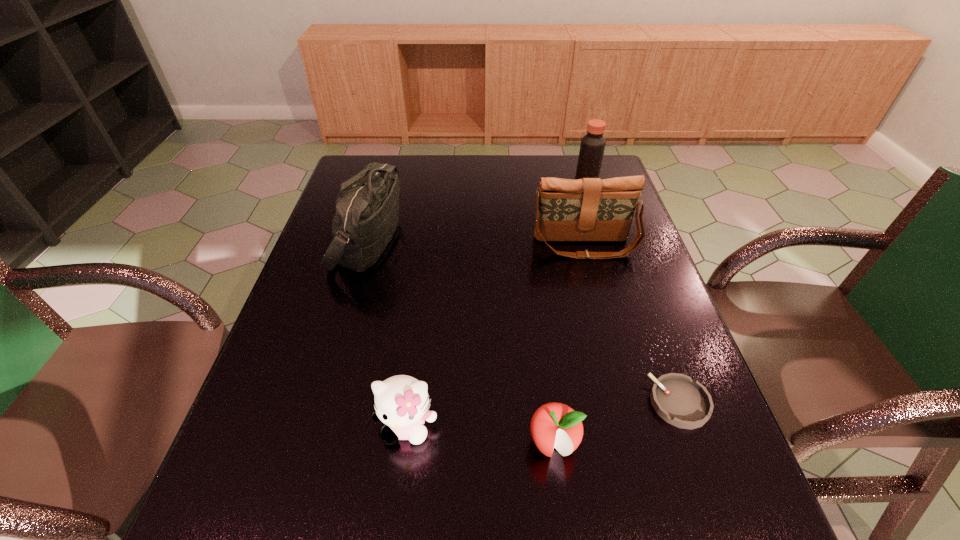
The width and height of the screenshot is (960, 540). Find the location of `vacant space at the far edge of the desktop`. vacant space at the far edge of the desktop is located at coordinates pos(438,165).

This screenshot has height=540, width=960. I want to click on free spot at the near edge of the desktop, so (652, 518).

At what (x,y) coordinates should I click in order to perform the action: click on free region at the left edge of the desktop. Please return your answer as a coordinate pair (x, y). Looking at the image, I should click on (285, 385).

Find the location of `vacant space at the right edge`. vacant space at the right edge is located at coordinates (638, 319).

This screenshot has width=960, height=540. Find the location of `free space between the second object from left to right and the vinegar`. free space between the second object from left to right and the vinegar is located at coordinates (496, 306).

The height and width of the screenshot is (540, 960). I want to click on free point between the right shoulder bag and the taller shoulder bag, so click(476, 244).

You are a GUI agent. You are given a task and a screenshot of the screen. Output one action in this format:
    pyautogui.click(x=<x>, y=<y>)
    Task: Click on the vacant region between the third shortest object and the farthest object
    The height and width of the screenshot is (540, 960).
    Given the screenshot: What is the action you would take?
    pyautogui.click(x=496, y=306)

At what (x,y) coordinates should I click in order to perform the action: click on free space between the fifth tallest object and the farthest object. Please return your answer as a coordinate pair (x, y). Looking at the image, I should click on (569, 315).

The width and height of the screenshot is (960, 540). I want to click on unoccupied position between the taller shoulder bag and the shortest object, so click(524, 322).

Locate an element on the screen. The width and height of the screenshot is (960, 540). vacant region between the kitten and the vinegar is located at coordinates (496, 306).